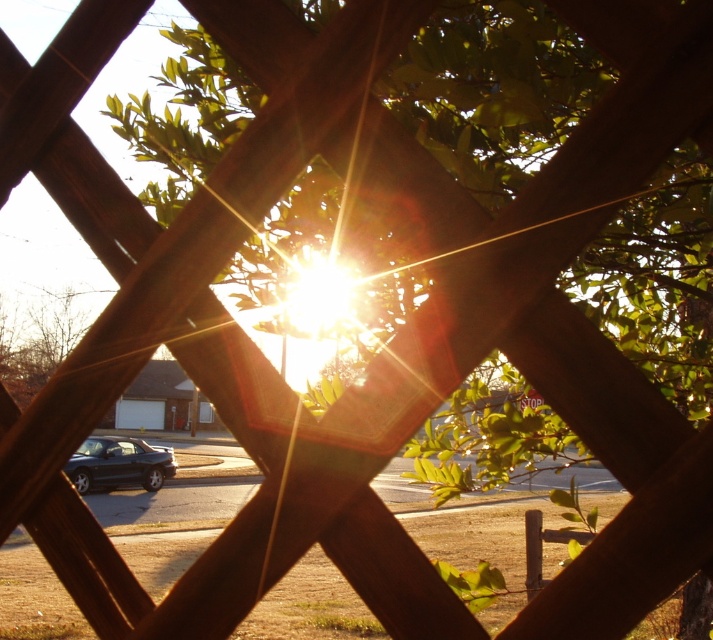
Who is positioned more to the right, shiny black car at center or metallic silver stop sign at center?

metallic silver stop sign at center

Locate an element on the screen. This screenshot has width=713, height=640. shiny black car at center is located at coordinates (118, 464).